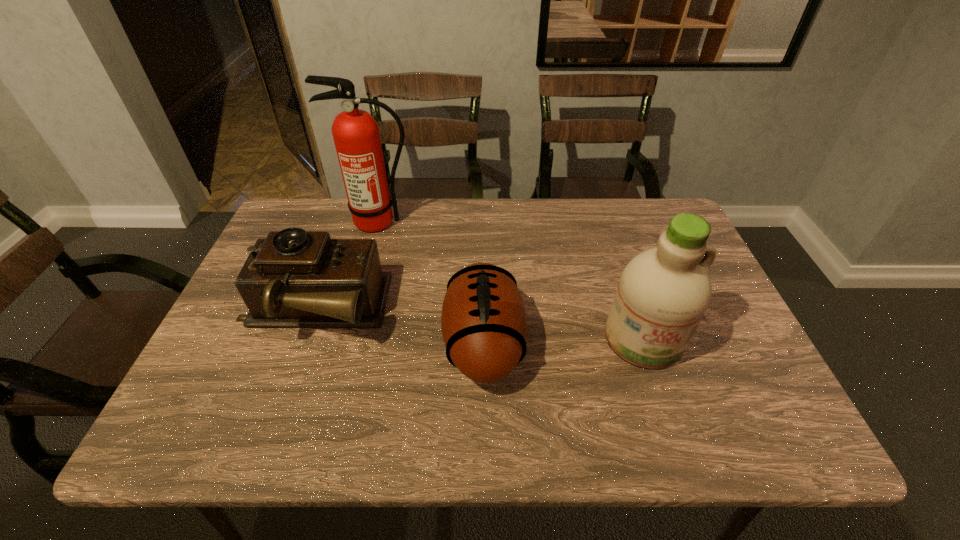
You are a GUI agent. You are given a task and a screenshot of the screen. Output one action in this format:
    pyautogui.click(x=<x>, y=<y>)
    Task: Click on the tallest object
    Image resolution: width=960 pixels, height=540 pixels.
    Given the screenshot: What is the action you would take?
    pyautogui.click(x=356, y=135)

What are the coordinates of `fire extinguisher` in the screenshot? It's located at (356, 135).

Find the location of a particular element. The width and height of the screenshot is (960, 540). the rightmost object is located at coordinates (663, 293).

Where is `cleansing agent`? The image size is (960, 540). cleansing agent is located at coordinates (663, 293).

In order to click on the second shortest object in this screenshot , I will do `click(293, 278)`.

You are a GUI agent. You are given a task and a screenshot of the screen. Output one action in this format:
    pyautogui.click(x=<x>, y=<y>)
    Task: Click on the football (American)
    
    Given the screenshot: What is the action you would take?
    pyautogui.click(x=484, y=325)

The height and width of the screenshot is (540, 960). In order to click on the shortest object in this screenshot , I will do `click(484, 325)`.

The height and width of the screenshot is (540, 960). I want to click on free point located 0.370m on the handle side of the farthest object, so click(x=348, y=333).

Where is `free space located 0.080m on the front label of the cleansing agent`? Image resolution: width=960 pixels, height=540 pixels. free space located 0.080m on the front label of the cleansing agent is located at coordinates (664, 404).

You are a GUI agent. You are given a task and a screenshot of the screen. Output one action in this format:
    pyautogui.click(x=<x>, y=<y>)
    Task: Click on the free location located 0.260m on the horn of the second shortest object
    
    Given the screenshot: What is the action you would take?
    pyautogui.click(x=490, y=310)